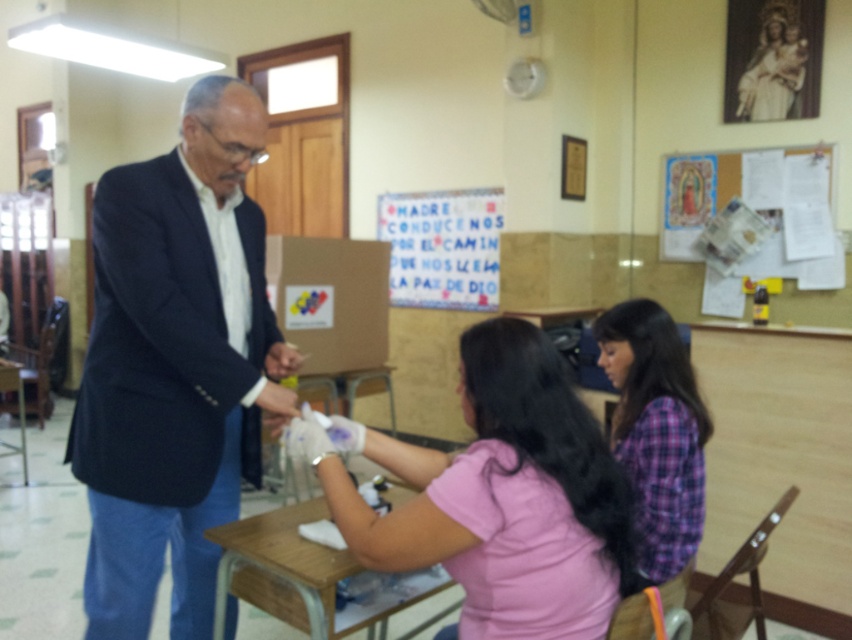
Question: Based on their relative distances, which object is farther from the dark blue suit at center?

Choices:
 (A) pink matte shirt at center
 (B) wooden desk at lower left

Answer: (B)

Question: Is purple plaid shirt at lower right smaller than wooden desk at lower left?

Choices:
 (A) no
 (B) yes

Answer: (B)

Question: Is the position of purple plaid shirt at lower right less distant than that of wooden table at center?

Choices:
 (A) yes
 (B) no

Answer: (A)

Question: Among these points, which one is nearest to the camera?

Choices:
 (A) (494, 339)
 (B) (309, 500)
 (C) (194, 596)

Answer: (A)

Question: Is dark blue suit at center above pink matte shirt at center?

Choices:
 (A) yes
 (B) no

Answer: (A)

Question: Which of the following is the farthest from the observer?

Choices:
 (A) (154, 237)
 (B) (300, 621)
 (C) (9, 378)
 (D) (409, 566)

Answer: (C)